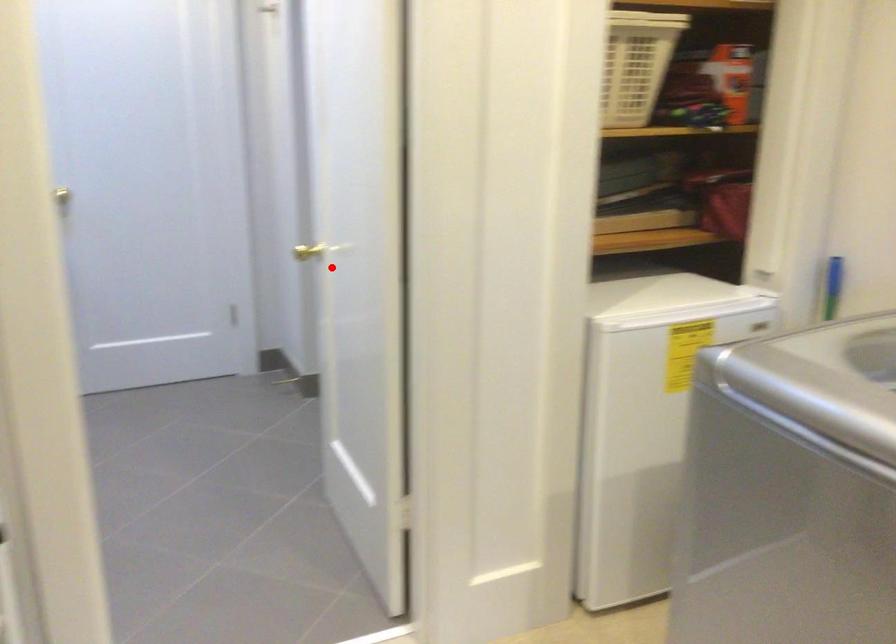
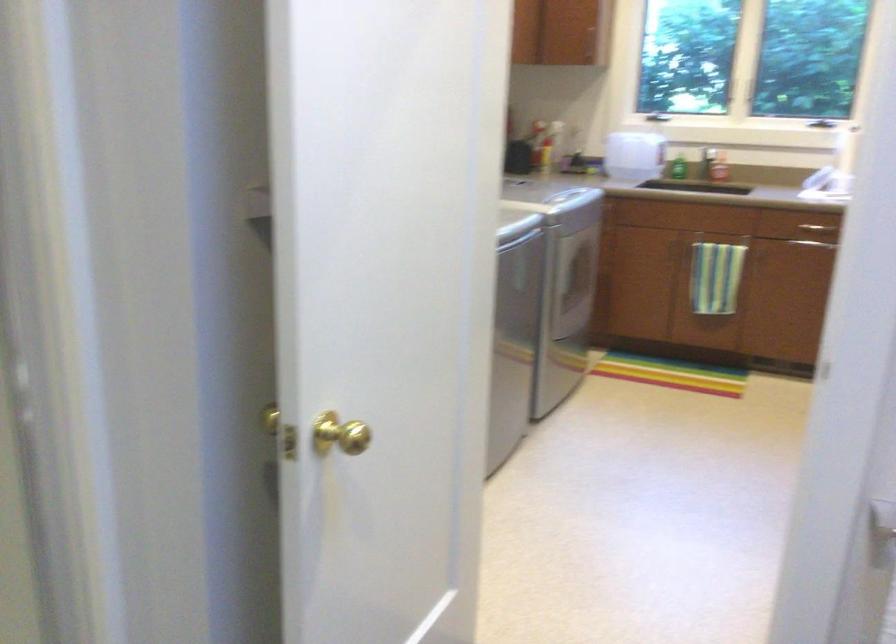
Question: I am providing you with two images of the same scene from different viewpoints. In image1, a red point is highlighted. Considering the same 3D point in image2, which of the following is correct?

Choices:
 (A) It is closer
 (B) It is farther

Answer: (A)